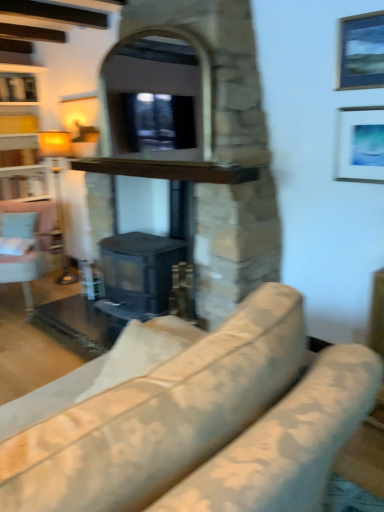
Question: From the image's perspective, would you say brown wooden shelf at center is shown under matte white picture frame at upper right, arranged as the first picture frame when ordered from the bottom?

Choices:
 (A) yes
 (B) no

Answer: (B)

Question: Considering the relative positions of brown wooden shelf at center and matte white picture frame at upper right, acting as the second picture frame starting from the top, in the image provided, is brown wooden shelf at center to the right of matte white picture frame at upper right, acting as the second picture frame starting from the top, from the viewer's perspective?

Choices:
 (A) yes
 (B) no

Answer: (B)

Question: Is brown wooden shelf at center positioned beyond the bounds of matte white picture frame at upper right, arranged as the first picture frame when ordered from the bottom?

Choices:
 (A) no
 (B) yes

Answer: (B)

Question: Is brown wooden shelf at center wider than matte white picture frame at upper right, acting as the second picture frame starting from the top?

Choices:
 (A) yes
 (B) no

Answer: (A)

Question: Can you confirm if brown wooden shelf at center is shorter than matte white picture frame at upper right, arranged as the first picture frame when ordered from the bottom?

Choices:
 (A) yes
 (B) no

Answer: (A)

Question: Considering the relative positions of brown wooden shelf at center and matte white picture frame at upper right, acting as the second picture frame starting from the top, in the image provided, is brown wooden shelf at center behind matte white picture frame at upper right, acting as the second picture frame starting from the top,?

Choices:
 (A) no
 (B) yes

Answer: (B)

Question: Is there a large distance between metallic silver picture frame at upper right, the 2th picture frame positioned from the bottom, and floral fabric couch at center?

Choices:
 (A) yes
 (B) no

Answer: (A)

Question: Is metallic silver picture frame at upper right, the 2th picture frame positioned from the bottom, not inside floral fabric couch at center?

Choices:
 (A) no
 (B) yes

Answer: (B)

Question: Is metallic silver picture frame at upper right, the 2th picture frame positioned from the bottom, thinner than floral fabric couch at center?

Choices:
 (A) yes
 (B) no

Answer: (A)

Question: From the image's perspective, would you say metallic silver picture frame at upper right, the first picture frame viewed from the top, is positioned over floral fabric couch at center?

Choices:
 (A) no
 (B) yes

Answer: (B)

Question: Is the surface of metallic silver picture frame at upper right, the first picture frame viewed from the top, in direct contact with floral fabric couch at center?

Choices:
 (A) yes
 (B) no

Answer: (B)

Question: Is metallic silver picture frame at upper right, the first picture frame viewed from the top, positioned in front of floral fabric couch at center?

Choices:
 (A) no
 (B) yes

Answer: (A)

Question: Does brown wooden shelf at center have a greater height compared to matte yellow lampshade at left?

Choices:
 (A) no
 (B) yes

Answer: (A)